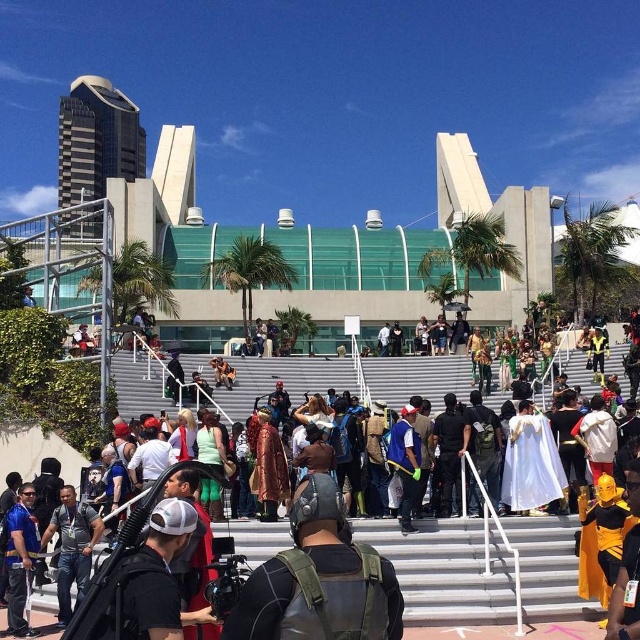
You are standing at the bottom of the staircase in the convention area and notice both the white cotton shirt at center and the matte black helmet at center. Which object is closer to you?

The white cotton shirt at center is closer to you since it is further to the viewer than the matte black helmet at center.